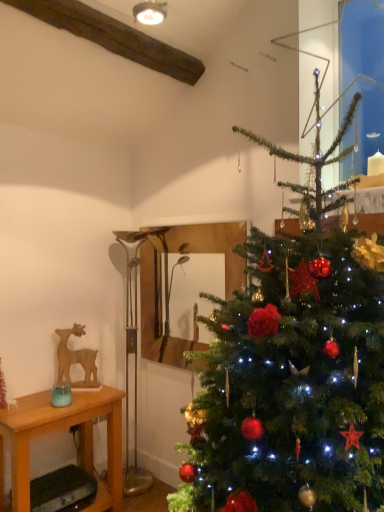
You are a GUI agent. You are given a task and a screenshot of the screen. Output one action in this format:
    pyautogui.click(x=<x>, y=<y>)
    Task: Click on the wooden table at left
    Image resolution: width=384 pixels, height=512 pixels.
    Given the screenshot: What is the action you would take?
    pyautogui.click(x=61, y=430)

I want to click on green matte christmas tree at right, so click(293, 371).

Locate an element on the screen. wooden mirror at center is located at coordinates (161, 281).

Identify the location of wooden table at left. The width and height of the screenshot is (384, 512). (61, 430).

Are green matte christmas tree at right and wooden deer at left far apart?

Absolutely, green matte christmas tree at right is distant from wooden deer at left.

Which is behind, point (338, 228) or point (63, 373)?

The point (63, 373) is farther from the camera.

From a real-world perspective, who is located lower, green matte christmas tree at right or wooden deer at left?

In real-world perspective, wooden deer at left is lower.

Considering the sizes of objects green matte christmas tree at right and wooden deer at left in the image provided, who is wider, green matte christmas tree at right or wooden deer at left?

green matte christmas tree at right is wider.

Is green matte christmas tree at right shorter than wooden mirror at center?

Incorrect, the height of green matte christmas tree at right does not fall short of that of wooden mirror at center.

From a real-world perspective, is green matte christmas tree at right positioned above or below wooden mirror at center?

green matte christmas tree at right is below wooden mirror at center.

Considering the sizes of objects green matte christmas tree at right and wooden mirror at center in the image provided, who is smaller, green matte christmas tree at right or wooden mirror at center?

wooden mirror at center is smaller.

How many degrees apart are the facing directions of green matte christmas tree at right and wooden mirror at center?

They differ by 1.69 degrees in their facing directions.

From the image's perspective, which is below, green matte christmas tree at right or wooden table at left?

wooden table at left.

Is green matte christmas tree at right completely or partially outside of wooden table at left?

Absolutely, green matte christmas tree at right is external to wooden table at left.

From a real-world perspective, between green matte christmas tree at right and wooden table at left, who is vertically lower?

wooden table at left is physically lower.

In the image, is green matte christmas tree at right positioned in front of or behind wooden table at left?

green matte christmas tree at right is in front of wooden table at left.

I want to click on desk directly beneath the wooden deer at left (from a real-world perspective), so click(x=61, y=430).

How much distance is there between wooden deer at left and wooden table at left?

wooden deer at left and wooden table at left are 15.99 inches apart from each other.

From the image's perspective, which is above, wooden deer at left or wooden table at left?

wooden deer at left is shown above in the image.

Is wooden deer at left directly adjacent to wooden table at left?

No.

Is point (94, 351) positioned behind point (160, 267)?

No.

Is the surface of wooden deer at left in direct contact with wooden mirror at center?

There is a gap between wooden deer at left and wooden mirror at center.

Locate an element on the screen. This screenshot has width=384, height=512. animal to the left of wooden mirror at center is located at coordinates (76, 358).

Considering the relative sizes of wooden deer at left and wooden mirror at center in the image provided, is wooden deer at left wider than wooden mirror at center?

Indeed, wooden deer at left has a greater width compared to wooden mirror at center.

Considering the points (81, 456) and (88, 382), which point is in front, point (81, 456) or point (88, 382)?

The point (88, 382) is closer to the camera.

Is wooden deer at left located within wooden table at left?

That's incorrect, wooden deer at left is not inside wooden table at left.

Is wooden table at left in front of or behind wooden deer at left in the image?

Visually, wooden table at left is located in front of wooden deer at left.

What's the angular difference between wooden table at left and wooden deer at left's facing directions?

50.4 degrees.

Is wooden deer at left positioned with its back to green matte christmas tree at right?

No, green matte christmas tree at right is not at the back of wooden deer at left.

Between wooden deer at left and green matte christmas tree at right, which one has smaller width?

Thinner between the two is wooden deer at left.

Is wooden deer at left closer to camera compared to green matte christmas tree at right?

That is False.

Is wooden deer at left next to green matte christmas tree at right?

They are not placed beside each other.

Locate an element on the screen. animal below the green matte christmas tree at right (from the image's perspective) is located at coordinates (76, 358).

In order to click on christmas tree below the wooden mirror at center (from a real-world perspective) in this screenshot , I will do `click(293, 371)`.

Based on the photo, considering their positions, is green matte christmas tree at right positioned further to wooden mirror at center than wooden deer at left?

green matte christmas tree at right is further to wooden mirror at center.

Based on their spatial positions, is wooden deer at left or wooden mirror at center further from wooden table at left?

wooden mirror at center lies further to wooden table at left than the other object.

Based on their spatial positions, is wooden mirror at center or green matte christmas tree at right closer to wooden deer at left?

wooden mirror at center lies closer to wooden deer at left than the other object.

Estimate the real-world distances between objects in this image. Which object is closer to wooden table at left, wooden mirror at center or wooden deer at left?

wooden deer at left is closer to wooden table at left.

Which object lies further to the anchor point wooden table at left, wooden mirror at center or green matte christmas tree at right?

green matte christmas tree at right is positioned further to the anchor wooden table at left.

Estimate the real-world distances between objects in this image. Which object is further from green matte christmas tree at right, wooden mirror at center or wooden table at left?

wooden mirror at center lies further to green matte christmas tree at right than the other object.

Based on their spatial positions, is green matte christmas tree at right or wooden mirror at center further from wooden deer at left?

green matte christmas tree at right is positioned further to the anchor wooden deer at left.

Considering their positions, is wooden deer at left positioned further to wooden table at left than green matte christmas tree at right?

Result: Among the two, green matte christmas tree at right is located further to wooden table at left.

Locate an element on the screen. This screenshot has width=384, height=512. animal that lies between wooden mirror at center and wooden table at left from top to bottom is located at coordinates (76, 358).

This screenshot has width=384, height=512. Identify the location of desk located between green matte christmas tree at right and wooden mirror at center in the depth direction. (61, 430).

The image size is (384, 512). What are the coordinates of `mirror located between green matte christmas tree at right and wooden deer at left in the depth direction` in the screenshot? It's located at (161, 281).

Identify the location of desk positioned between green matte christmas tree at right and wooden deer at left from near to far. (61, 430).